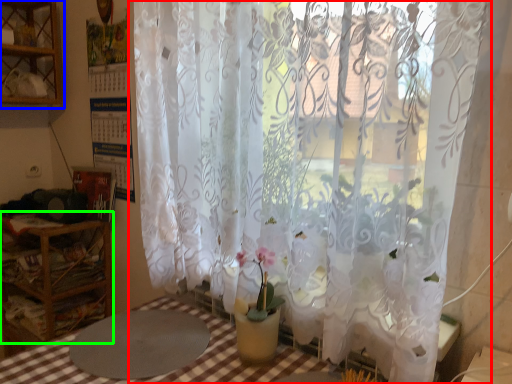
Question: Which object is positioned farthest from curtain (highlighted by a red box)? Select from shelf (highlighted by a blue box) and furniture (highlighted by a green box).

Choices:
 (A) shelf
 (B) furniture

Answer: (A)